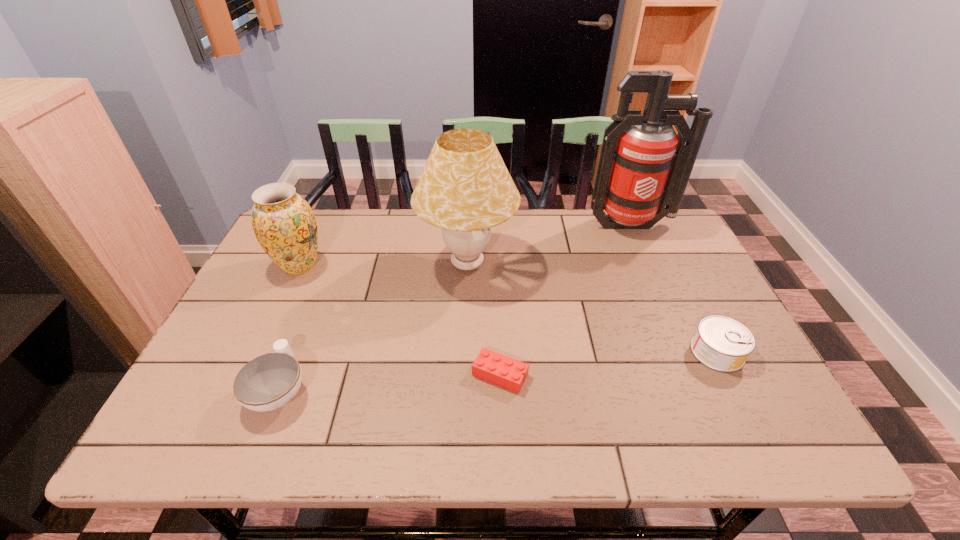
This screenshot has height=540, width=960. Find the location of `vacant point that satisfies the following two spatial constraints: 1. on the side with the handle of the chinaware; 2. on the left side of the shortest object`. vacant point that satisfies the following two spatial constraints: 1. on the side with the handle of the chinaware; 2. on the left side of the shortest object is located at coordinates (285, 375).

Where is `free space in the image that satisfies the following two spatial constraints: 1. on the side with the handle of the can; 2. on the left side of the chinaware`? This screenshot has height=540, width=960. free space in the image that satisfies the following two spatial constraints: 1. on the side with the handle of the can; 2. on the left side of the chinaware is located at coordinates (295, 352).

Where is `vacant space that satisfies the following two spatial constraints: 1. on the side with the handle of the chinaware; 2. on the left side of the can`? This screenshot has width=960, height=540. vacant space that satisfies the following two spatial constraints: 1. on the side with the handle of the chinaware; 2. on the left side of the can is located at coordinates (295, 352).

The image size is (960, 540). Find the location of `free region that satisfies the following two spatial constraints: 1. on the side with the handle of the chinaware; 2. on the left side of the Lego`. free region that satisfies the following two spatial constraints: 1. on the side with the handle of the chinaware; 2. on the left side of the Lego is located at coordinates (285, 375).

This screenshot has height=540, width=960. Find the location of `vacant space that satisfies the following two spatial constraints: 1. on the side with the handle of the chinaware; 2. on the right side of the can`. vacant space that satisfies the following two spatial constraints: 1. on the side with the handle of the chinaware; 2. on the right side of the can is located at coordinates (295, 352).